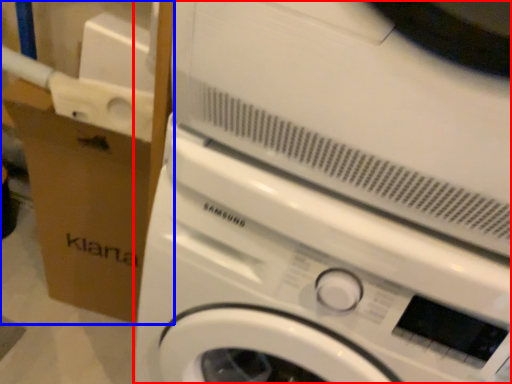
Question: Among these objects, which one is farthest to the camera, washing machine (highlighted by a red box) or cardboard box (highlighted by a blue box)?

Choices:
 (A) washing machine
 (B) cardboard box

Answer: (B)